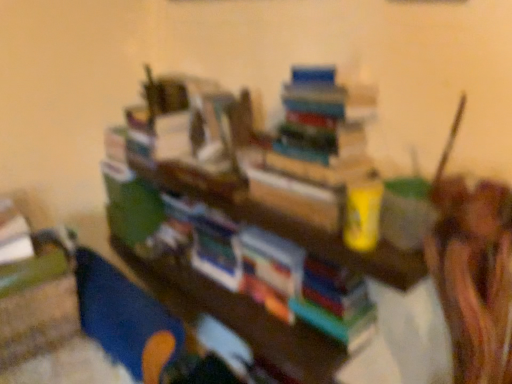
Question: From the image's perspective, is blue plastic toy at lower left positioned above or below hardcover books at upper center?

Choices:
 (A) below
 (B) above

Answer: (A)

Question: In terms of height, does blue plastic toy at lower left look taller or shorter compared to hardcover books at upper center?

Choices:
 (A) tall
 (B) short

Answer: (A)

Question: Relative to hardcover books at upper center, is blue plastic toy at lower left in front or behind?

Choices:
 (A) behind
 (B) front

Answer: (A)

Question: Looking at their shapes, would you say hardcover books at upper center is wider or thinner than blue plastic toy at lower left?

Choices:
 (A) thin
 (B) wide

Answer: (A)

Question: Considering the positions of hardcover books at upper center and blue plastic toy at lower left in the image, is hardcover books at upper center bigger or smaller than blue plastic toy at lower left?

Choices:
 (A) small
 (B) big

Answer: (A)

Question: From the image's perspective, relative to blue plastic toy at lower left, is hardcover books at upper center above or below?

Choices:
 (A) below
 (B) above

Answer: (B)

Question: Relative to blue plastic toy at lower left, is hardcover books at upper center in front or behind?

Choices:
 (A) behind
 (B) front

Answer: (B)